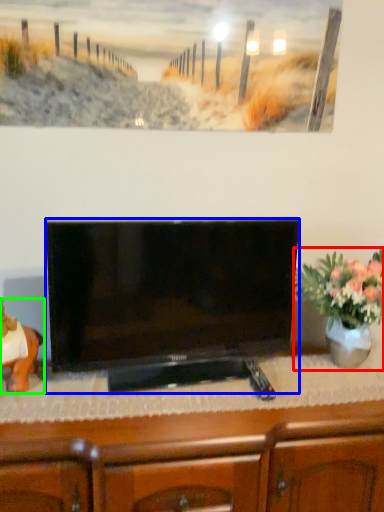
Question: Which object is positioned farthest from houseplant (highlighted by a red box)? Select from television (highlighted by a blue box) and animal (highlighted by a green box).

Choices:
 (A) television
 (B) animal

Answer: (B)